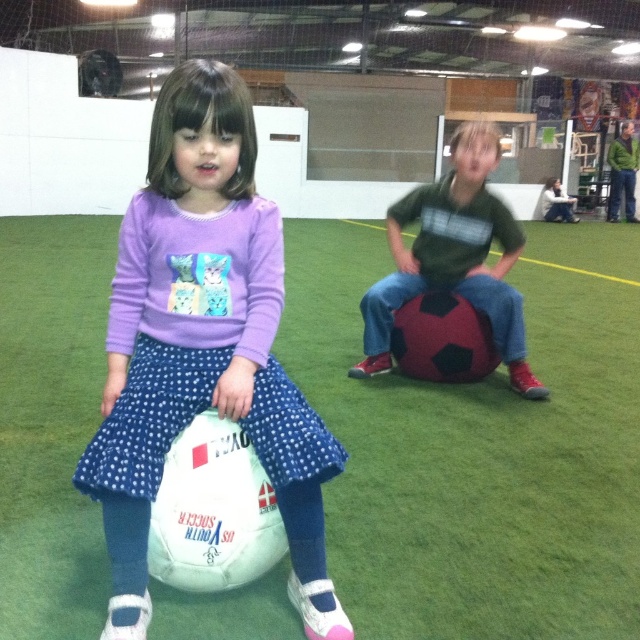
Who is higher up, green artificial turf at center or dark green jersey at center?

dark green jersey at center is higher up.

Based on the photo, who is taller, green artificial turf at center or dark green jersey at center?

dark green jersey at center is taller.

Is point (611, 340) positioned in front of point (433, 289)?

No, it is not.

The image size is (640, 640). In order to click on green artificial turf at center in this screenshot , I will do `click(480, 448)`.

Who is lower down, green artificial turf at center or white matte soccer ball at center?

Positioned lower is green artificial turf at center.

Between point (346, 529) and point (157, 140), which one is positioned behind?

Positioned behind is point (346, 529).

Locate an element on the screen. green artificial turf at center is located at coordinates (480, 448).

Between white matte soccer ball at center and dark green jersey at center, which one appears on the right side from the viewer's perspective?

From the viewer's perspective, dark green jersey at center appears more on the right side.

Does white matte soccer ball at center have a greater width compared to dark green jersey at center?

In fact, white matte soccer ball at center might be narrower than dark green jersey at center.

Measure the distance between point (157, 202) and camera.

They are 1.43 meters apart.

This screenshot has height=640, width=640. Identify the location of white matte soccer ball at center. (204, 346).